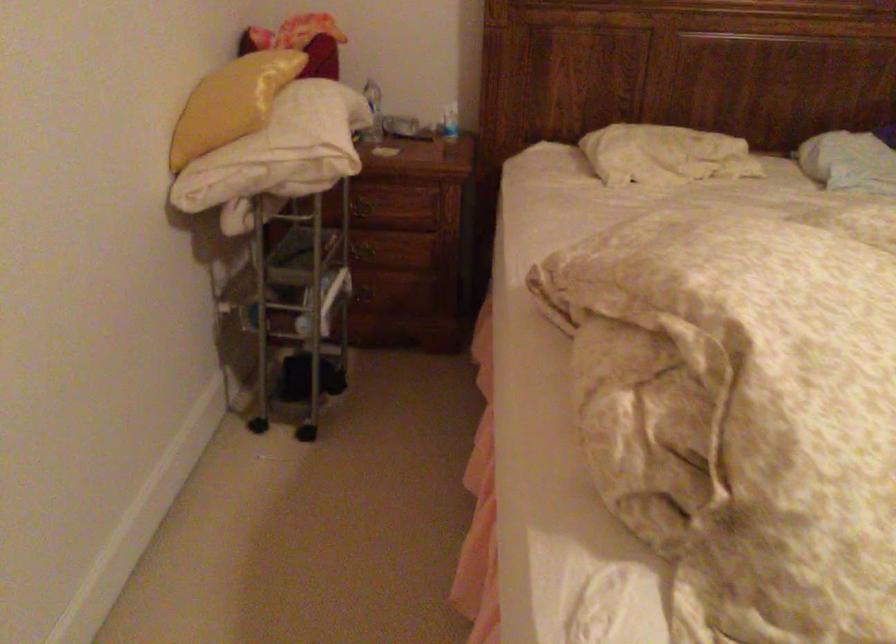
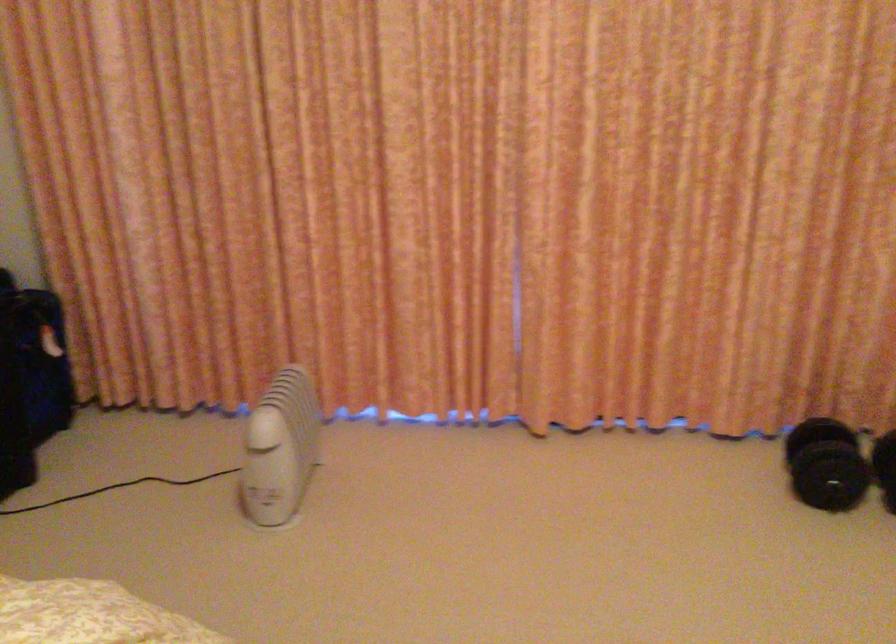
Question: The first image is from the beginning of the video and the second image is from the end. How did the camera likely rotate when shooting the video?

Choices:
 (A) Left
 (B) Right
 (C) Up
 (D) Down

Answer: (B)